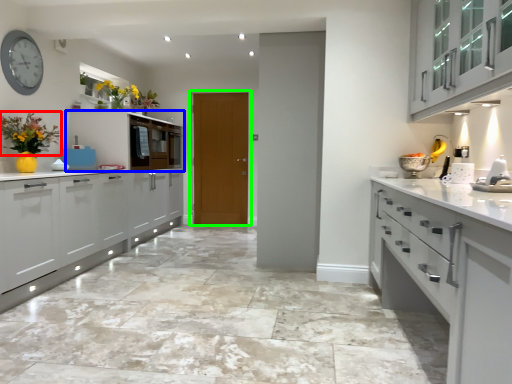
Question: Estimate the real-world distances between objects in this image. Which object is closer to floral arrangement (highlighted by a red box), cabinetry (highlighted by a blue box) or door (highlighted by a green box)?

Choices:
 (A) cabinetry
 (B) door

Answer: (A)